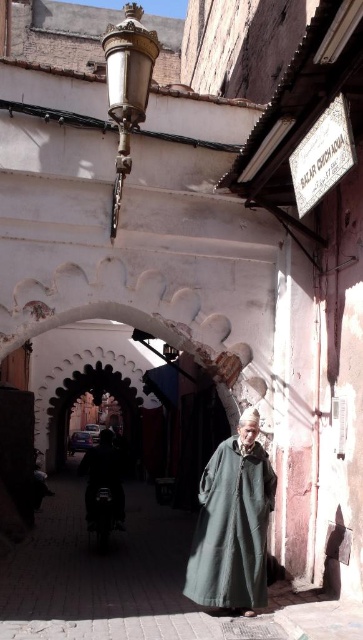
You are standing in the alleyway and want to touch the dark green fabric at center. Which direction should you move to reach it?

Since the dark green fabric at center is located at point 0.827 on the x axis and 0.639 on the y axis, you should move forward and to the right to reach it.

You are standing in the alleyway and see a dark green fabric at center. Can you tell me what is located at the coordinates point (231, 529)?

The dark green fabric at center is located at point (231, 529).